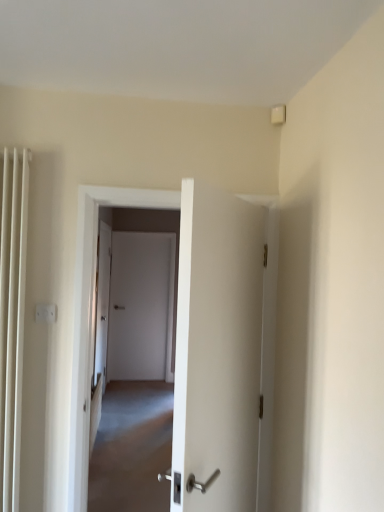
I want to click on white plastic electric outlet at upper left, so click(46, 313).

Measure the distance between white plastic electric outlet at upper left and camera.

white plastic electric outlet at upper left and camera are 1.95 meters apart.

The width and height of the screenshot is (384, 512). What do you see at coordinates (46, 313) in the screenshot?
I see `white plastic electric outlet at upper left` at bounding box center [46, 313].

Find the location of a particular element. The height and width of the screenshot is (512, 384). white plastic electric outlet at upper left is located at coordinates (46, 313).